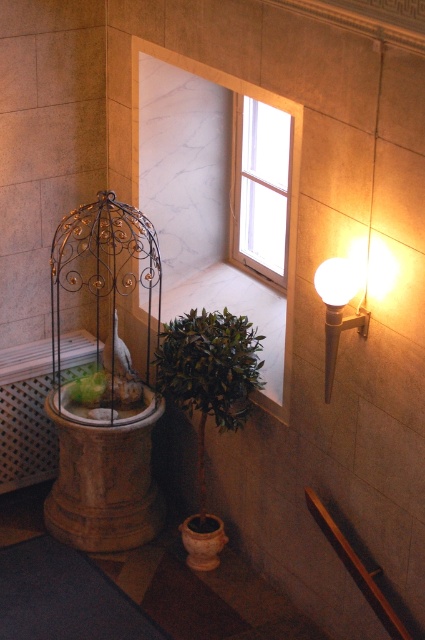
You are standing in the hallway and want to place a small decorative item on the floor. The item requires a space that is not occupied by the green leafy plant at lower center. Where should you place it?

Since the green leafy plant at lower center is located at point (209, 372), you can place the item elsewhere in the hallway, such as near the decorative birdcage on the left side or closer to the window in the background where there is no obstruction.

You are a gardener who wants to place a new small plant in the scene. You have a small plant that requires a space wider than the current green leafy plant at center. Can the matte terracotta pot at lower center accommodate this new plant?

The matte terracotta pot at lower center might be wider than the green leafy plant at center, so it could potentially accommodate the new plant if the width requirement is met.

You are standing in the hallway and want to know how far the point at coordinates (197, 566) is from your current position. Can you determine the distance?

The point at coordinates (197, 566) is 5.48 meters away from the camera, so the distance from your current position would be 5.48 meters.